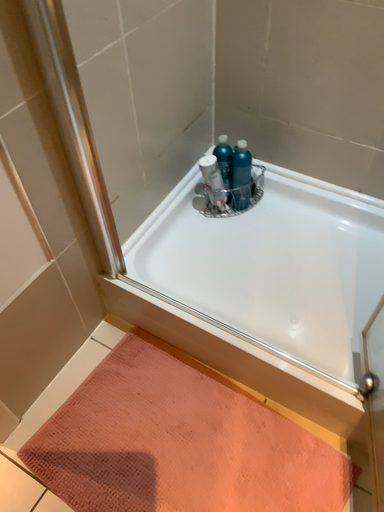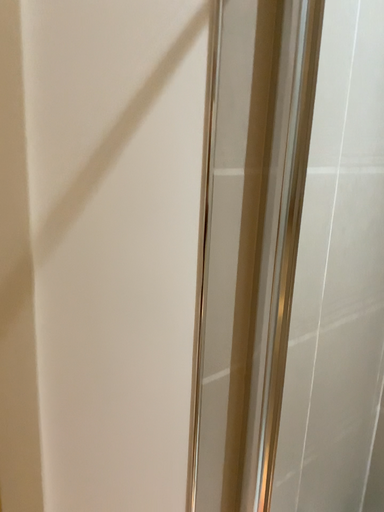
Question: How did the camera likely rotate when shooting the video?

Choices:
 (A) rotated downward
 (B) rotated upward

Answer: (B)